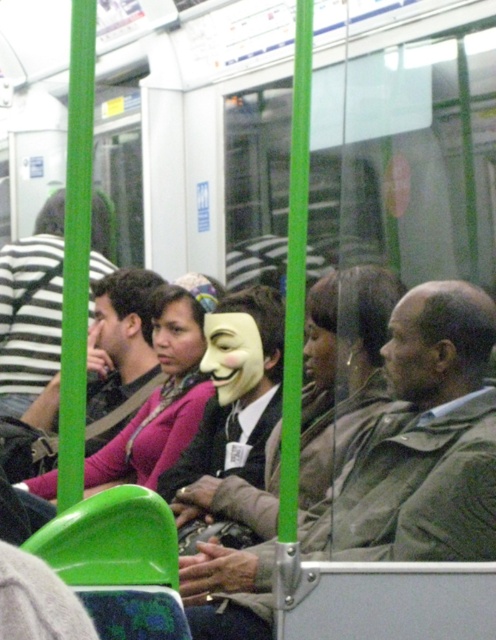
Looking at this image, you are a passenger on the train and want to know if the white matte mask at center can be placed inside the matte black jacket at left without folding it. Can it fit?

The white matte mask at center occupies less space than matte black jacket at left, so yes, the white matte mask at center can fit inside the matte black jacket at left without needing to fold it.